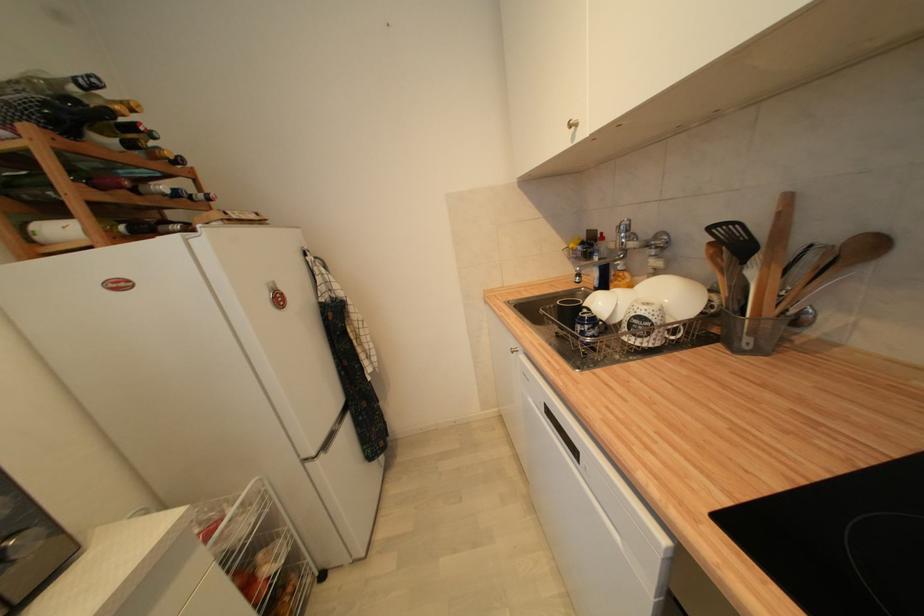
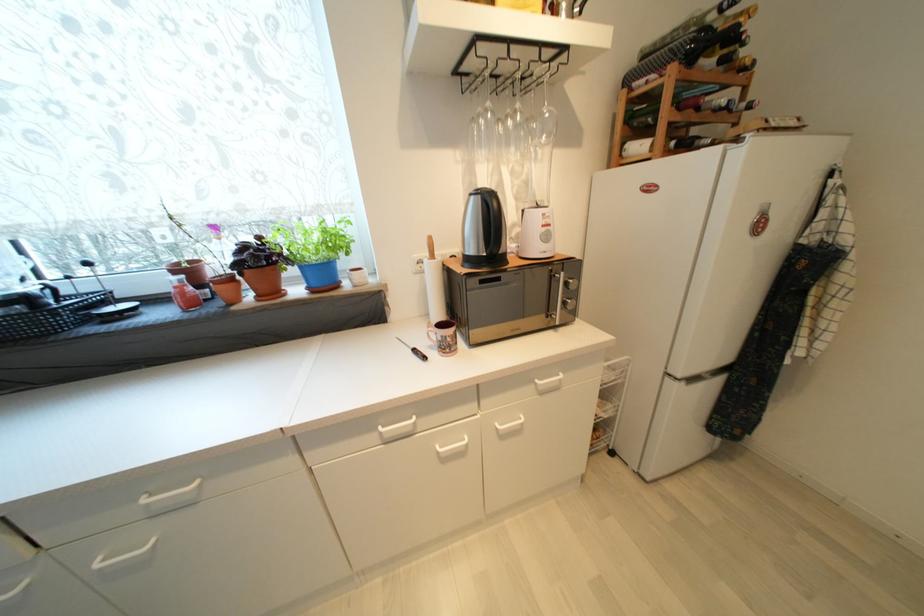
The images are taken continuously from a first-person perspective. In which direction is your viewpoint rotating?

The camera rotated toward left-down.